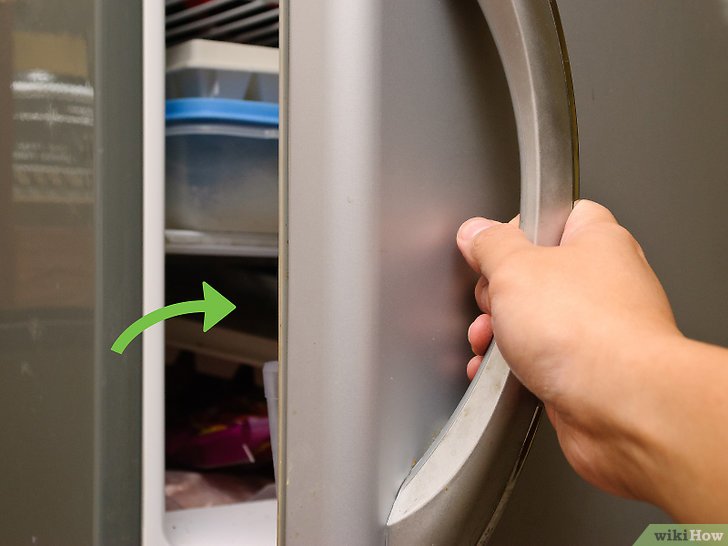
The height and width of the screenshot is (546, 728). I want to click on door seal of fridge, so click(x=149, y=195).